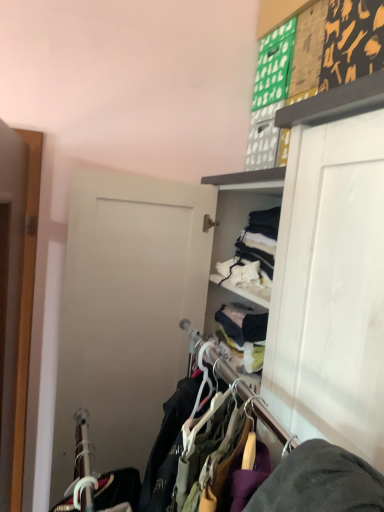
Describe the element at coordinates (276, 468) in the screenshot. I see `wooden hangers at center` at that location.

Identify the location of wooden hangers at center. The height and width of the screenshot is (512, 384). (276, 468).

Identify the location of wooden door at left. (10, 291).

What do you see at coordinates (10, 291) in the screenshot?
I see `wooden door at left` at bounding box center [10, 291].

What is the approximate width of wooden door at left?

wooden door at left is 12.89 centimeters wide.

Find the location of `wooden hangers at center`. wooden hangers at center is located at coordinates (276, 468).

Considering the positions of objects wooden hangers at center and wooden door at left in the image provided, who is more to the left, wooden hangers at center or wooden door at left?

wooden door at left.

In the image, is wooden hangers at center positioned in front of or behind wooden door at left?

In the image, wooden hangers at center appears in front of wooden door at left.

Between point (83, 410) and point (3, 127), which one is positioned behind?

The point (83, 410) is more distant.

From the image's perspective, which one is positioned higher, wooden hangers at center or wooden door at left?

wooden door at left, from the image's perspective.

From the picture: From a real-world perspective, which is physically above, wooden hangers at center or wooden door at left?

From a 3D spatial view, wooden door at left is above.

Looking at their sizes, would you say wooden hangers at center is wider or thinner than wooden door at left?

wooden hangers at center is wider than wooden door at left.

Is wooden hangers at center taller than wooden door at left?

Incorrect, the height of wooden hangers at center is not larger of that of wooden door at left.

Does wooden hangers at center have a larger size compared to wooden door at left?

Indeed, wooden hangers at center has a larger size compared to wooden door at left.

Is wooden door at left surrounded by wooden hangers at center?

No, wooden door at left is not surrounded by wooden hangers at center.

Is there a large distance between wooden hangers at center and wooden door at left?

No, there isn't a large distance between wooden hangers at center and wooden door at left.

Is wooden door at left at the back of wooden hangers at center?

No, wooden hangers at center is not facing away from wooden door at left.

I want to click on closet below the wooden door at left (from the image's perspective), so coord(276,468).

Is wooden door at left to the right of wooden hangers at center from the viewer's perspective?

In fact, wooden door at left is to the left of wooden hangers at center.

Is wooden door at left behind wooden hangers at center?

Yes.

Is point (1, 288) closer to viewer compared to point (223, 360)?

Yes, it is.

From the image's perspective, who appears lower, wooden door at left or wooden hangers at center?

wooden hangers at center, from the image's perspective.

From a real-world perspective, is wooden door at left positioned above or below wooden hangers at center?

From a real-world perspective, wooden door at left is physically above wooden hangers at center.

Which of these two, wooden door at left or wooden hangers at center, is thinner?

wooden door at left is thinner.

Considering the relative sizes of wooden door at left and wooden hangers at center in the image provided, is wooden door at left taller than wooden hangers at center?

Yes.

Considering the relative sizes of wooden door at left and wooden hangers at center in the image provided, is wooden door at left smaller than wooden hangers at center?

Yes, wooden door at left is smaller than wooden hangers at center.

Is wooden door at left situated inside wooden hangers at center or outside?

wooden door at left is not enclosed by wooden hangers at center.

Is wooden door at left touching wooden hangers at center?

No, wooden door at left is not beside wooden hangers at center.

Is wooden door at left oriented away from wooden hangers at center?

That's right, wooden door at left is facing away from wooden hangers at center.

What's the angular difference between wooden door at left and wooden hangers at center's facing directions?

They differ by 1.4 degrees in their facing directions.

Identify the location of door above the wooden hangers at center (from the image's perspective). Image resolution: width=384 pixels, height=512 pixels. (10, 291).

In the image, there is a wooden door at left. At what (x,y) coordinates should I click in order to perform the action: click on closet below it (from the image's perspective). Please return your answer as a coordinate pair (x, y). This screenshot has height=512, width=384. Looking at the image, I should click on tap(276, 468).

What are the coordinates of `door on the left of wooden hangers at center` in the screenshot? It's located at (10, 291).